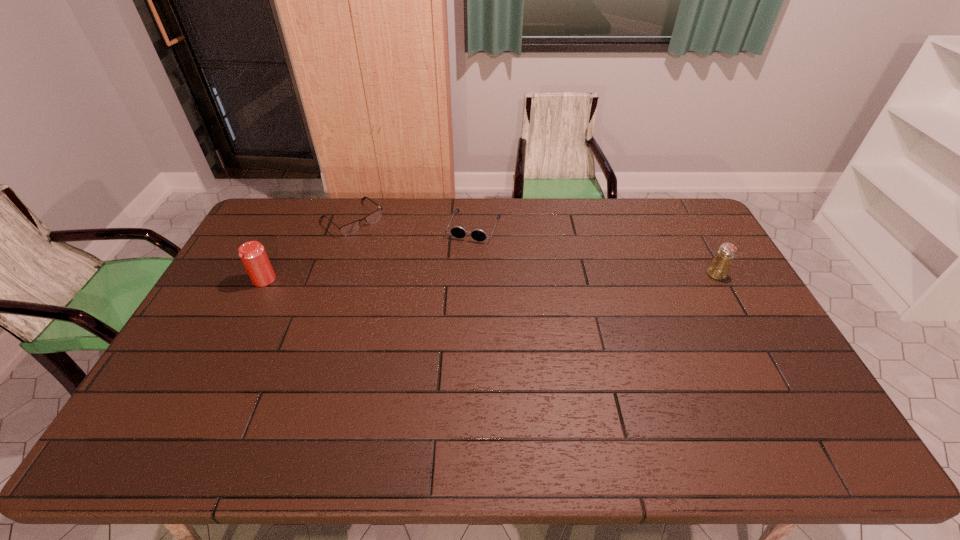
Locate an element on the screen. blank space located on the front-facing side of the sunglasses is located at coordinates (446, 298).

Locate an element on the screen. The image size is (960, 540). vacant space located 0.390m on the front-facing side of the spectacles is located at coordinates (438, 288).

This screenshot has height=540, width=960. I want to click on free space located on the front-facing side of the spectacles, so click(406, 262).

Identify the location of free location located 0.220m on the front-facing side of the spectacles. [406, 262].

Find the location of a particular element. Image resolution: width=960 pixels, height=540 pixels. sunglasses at the far edge is located at coordinates (459, 232).

Where is `spectacles that is positioned at the far edge`? The image size is (960, 540). spectacles that is positioned at the far edge is located at coordinates (350, 228).

Locate an element on the screen. The image size is (960, 540). object that is at the left edge is located at coordinates (253, 255).

You are a GUI agent. You are given a task and a screenshot of the screen. Output one action in this format:
    pyautogui.click(x=<x>, y=<y>)
    Task: Click on the object located in the right edge section of the desktop
    
    Given the screenshot: What is the action you would take?
    pyautogui.click(x=718, y=269)

In the image, there is a desktop. Identify the location of vacant space at the far edge. The image size is (960, 540). (354, 202).

The image size is (960, 540). In the image, there is a desktop. What are the coordinates of `vacant space at the near edge` in the screenshot? It's located at (552, 400).